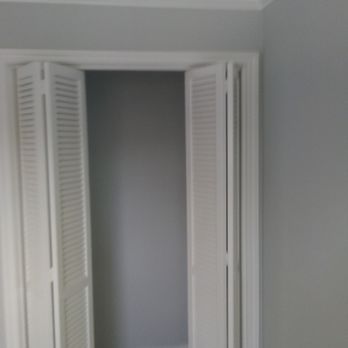
Image resolution: width=348 pixels, height=348 pixels. Identify the location of wall (to right of closet). (316, 290).